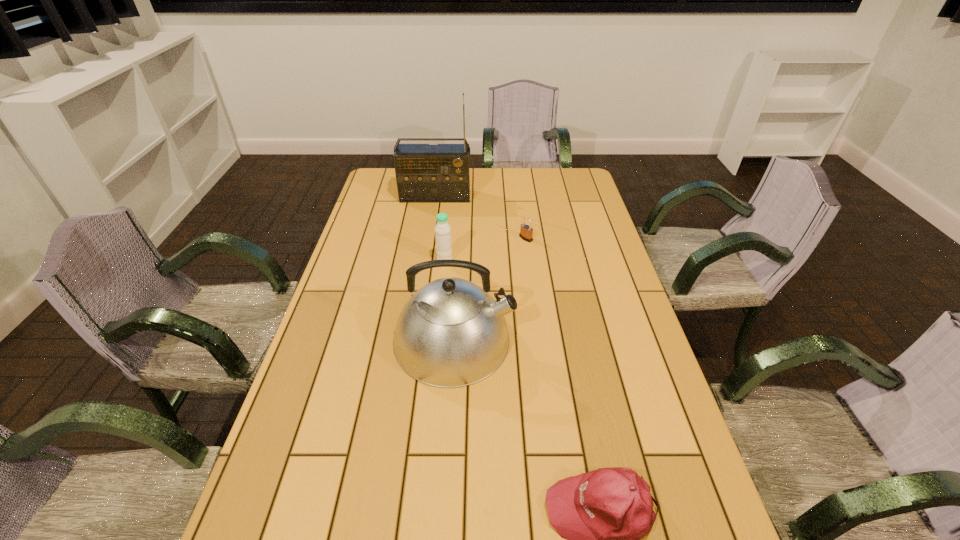
The width and height of the screenshot is (960, 540). I want to click on object that ranks as the second closest to the water bottle, so click(526, 232).

Where is `free spot that satisfies the following two spatial constraints: 1. on the front panel of the radio receiver; 2. on the right side of the third tallest object`? The height and width of the screenshot is (540, 960). free spot that satisfies the following two spatial constraints: 1. on the front panel of the radio receiver; 2. on the right side of the third tallest object is located at coordinates (426, 261).

Find the location of a particular element. vacant space that satisfies the following two spatial constraints: 1. on the front panel of the radio receiver; 2. on the right side of the third nearest object is located at coordinates (426, 261).